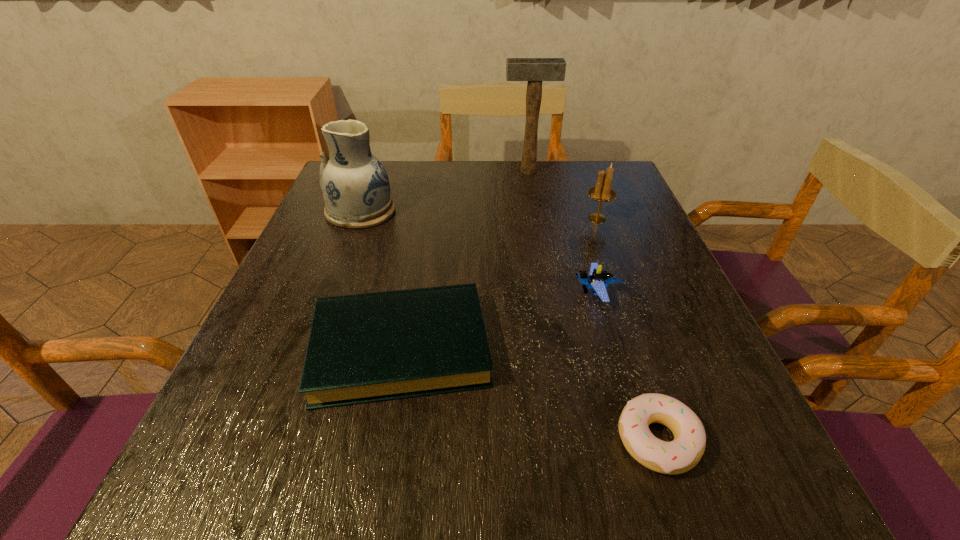
Locate an element on the screen. This screenshot has height=540, width=960. candle holder situated at the right edge is located at coordinates (602, 192).

Find the location of a particular element. Image resolution: width=960 pixels, height=540 pixels. Lego located at the right edge is located at coordinates (598, 279).

Where is `doughnut present at the right edge`? The width and height of the screenshot is (960, 540). doughnut present at the right edge is located at coordinates (683, 453).

Find the location of `object positioned at the far left corner`. object positioned at the far left corner is located at coordinates (356, 190).

Where is `object positioned at the near right corner`? Image resolution: width=960 pixels, height=540 pixels. object positioned at the near right corner is located at coordinates (683, 453).

The height and width of the screenshot is (540, 960). In the image, there is a desktop. In order to click on free space at the far edge in this screenshot , I will do `click(503, 164)`.

The width and height of the screenshot is (960, 540). I want to click on vacant space at the near edge of the desktop, so [577, 493].

At what (x,y) coordinates should I click in order to perform the action: click on vacant space at the left edge. Please return your answer as a coordinate pair (x, y). Image resolution: width=960 pixels, height=540 pixels. Looking at the image, I should click on (338, 249).

This screenshot has height=540, width=960. I want to click on vacant space at the right edge of the desktop, so click(x=646, y=256).

Image resolution: width=960 pixels, height=540 pixels. Find the location of `vacant space at the far right corner of the desktop`. vacant space at the far right corner of the desktop is located at coordinates (620, 192).